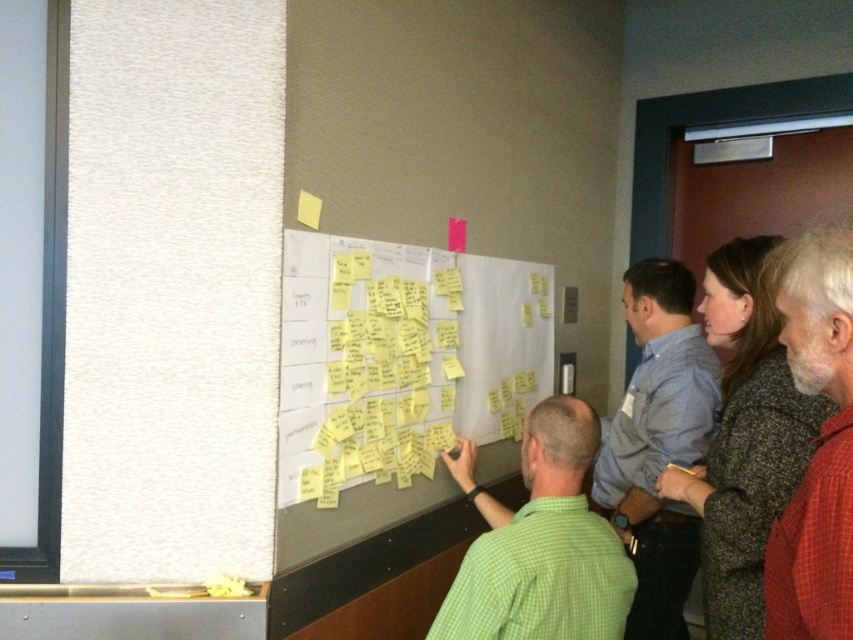
You are a new employee in the office and need to locate the blue shirt at right and the red plaid shirt at right during a meeting. Which of the two is standing more to the right side?

The blue shirt at right is positioned on the right side of red plaid shirt at right, so the blue shirt at right is more to the right side.

You are standing in the office scene described. There is a point marked at coordinates (x=659, y=442). Which object or person does this point correspond to?

The point at coordinates (x=659, y=442) corresponds to the blue shirt at right.

You are standing in the office scene described. There is a point at coordinates (401, 356). What is located at that point?

The point at coordinates (401, 356) indicates yellow sticky notes at center.